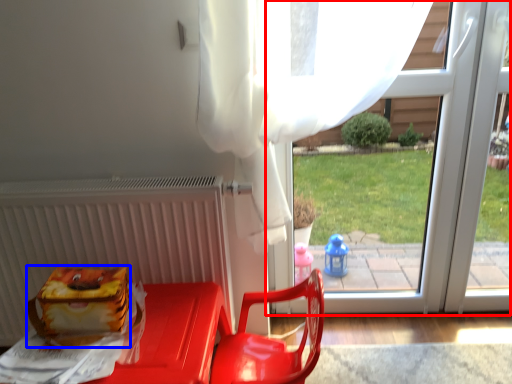
Question: Which object appears closest to the camera in this image, window (highlighted by a red box) or lunch box (highlighted by a blue box)?

Choices:
 (A) window
 (B) lunch box

Answer: (B)